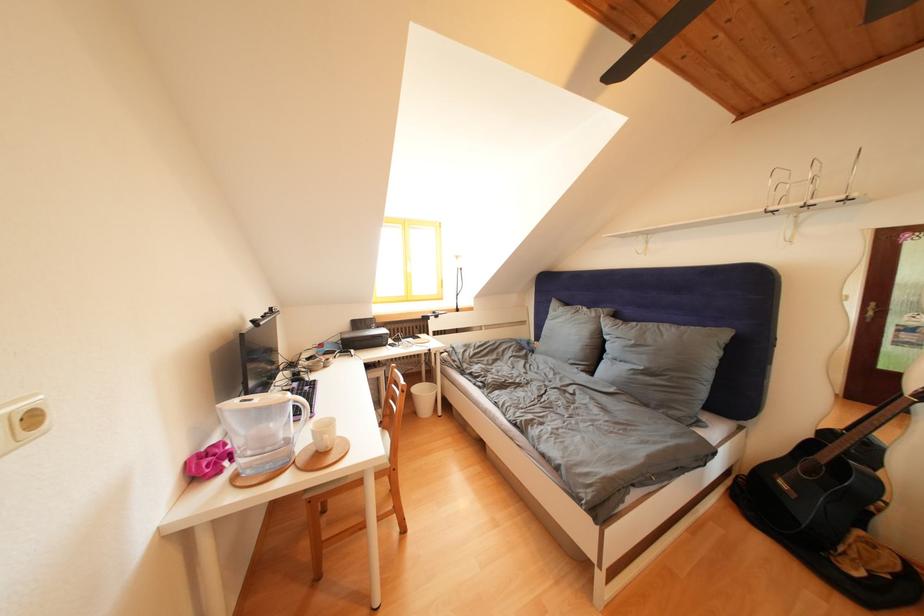
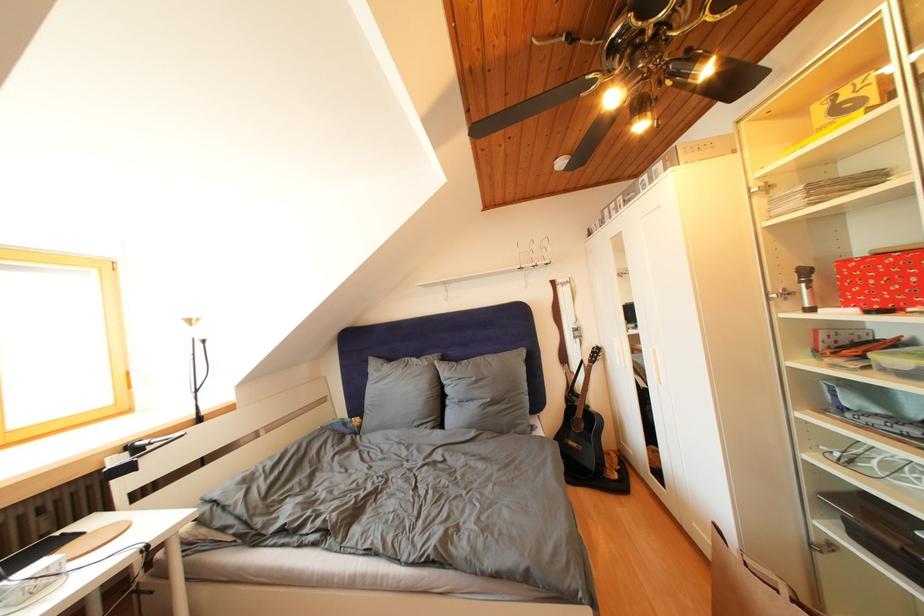
Question: The camera is either moving clockwise (left) or counter-clockwise (right) around the object. The first image is from the beginning of the video and the second image is from the end. Is the camera moving left or right when shooting the video?

Choices:
 (A) Left
 (B) Right

Answer: (A)